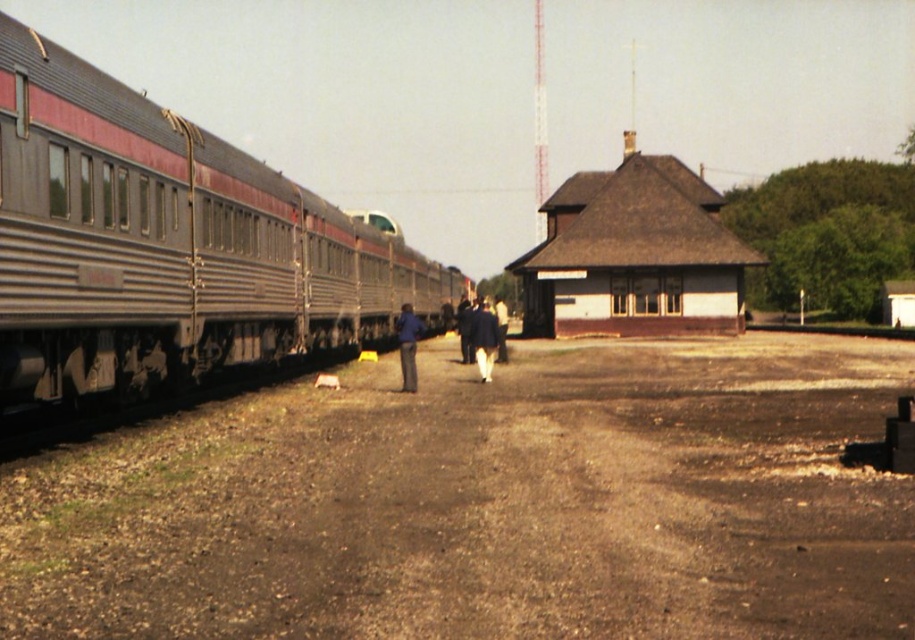
Is metal train track at center shorter than white fabric pants at center?

Correct, metal train track at center is not as tall as white fabric pants at center.

Can you confirm if metal train track at center is thinner than white fabric pants at center?

In fact, metal train track at center might be wider than white fabric pants at center.

Which is in front, point (767, 321) or point (501, 346)?

Point (501, 346) is more forward.

Find the location of `metal train track at center`. metal train track at center is located at coordinates (833, 328).

Which of these two, brown gravel dirt track at center or white fabric pants at center, stands taller?

With more height is white fabric pants at center.

Is brown gravel dirt track at center wider than white fabric pants at center?

Correct, the width of brown gravel dirt track at center exceeds that of white fabric pants at center.

Identify the location of brown gravel dirt track at center. (487, 506).

Who is positioned more to the right, brown gravel dirt track at center or silver metallic train at left?

From the viewer's perspective, brown gravel dirt track at center appears more on the right side.

Is brown gravel dirt track at center thinner than silver metallic train at left?

No.

Locate an element on the screen. The height and width of the screenshot is (640, 915). brown gravel dirt track at center is located at coordinates (487, 506).

This screenshot has width=915, height=640. I want to click on brown gravel dirt track at center, so click(487, 506).